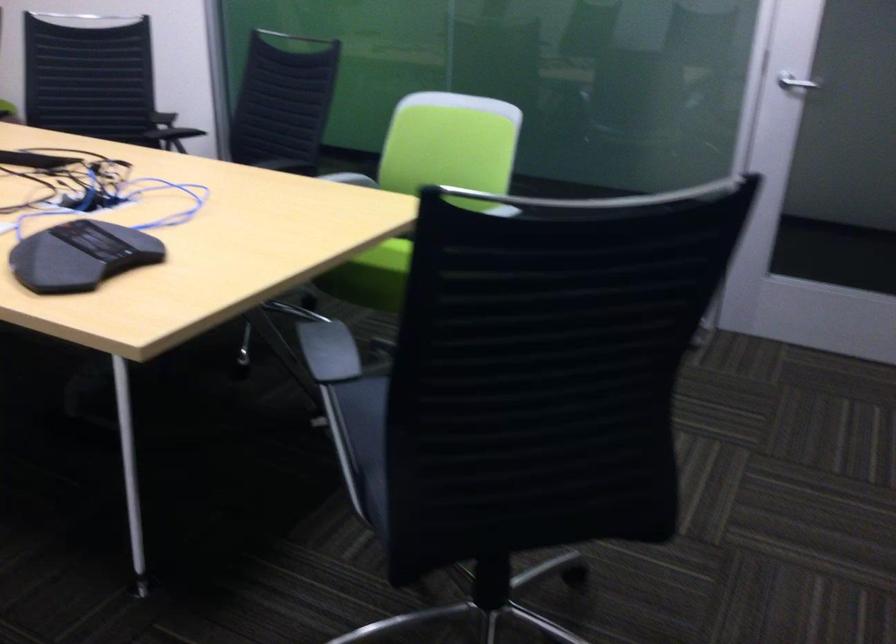
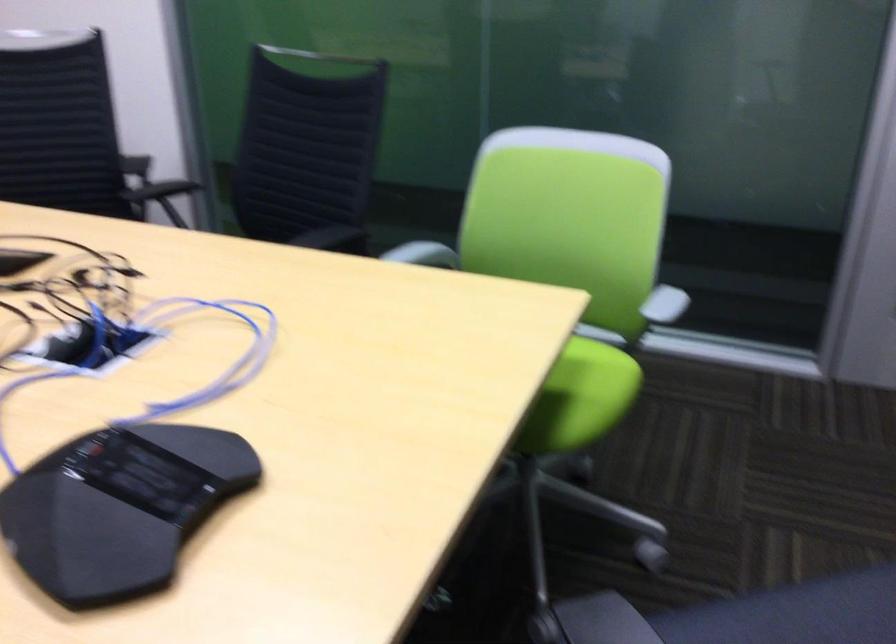
Locate, in the second image, the point that corresponds to (82,254) in the first image.

(119, 507)